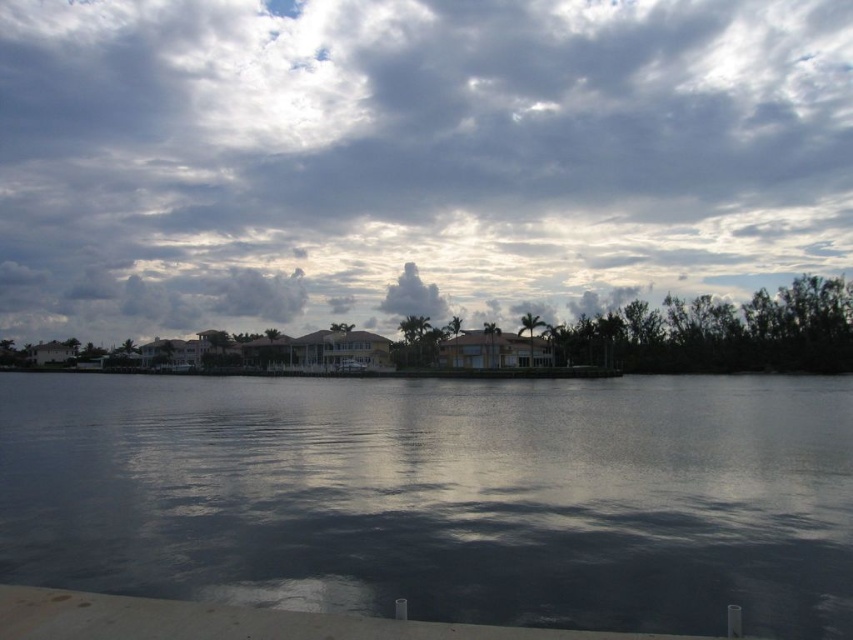
How much distance is there between dark reflective water at center and white fluffy cloud at upper center?

The distance of dark reflective water at center from white fluffy cloud at upper center is 409.20 feet.

Is dark reflective water at center taller than white fluffy cloud at upper center?

In fact, dark reflective water at center may be shorter than white fluffy cloud at upper center.

Which is in front, point (436, 483) or point (433, 304)?

Point (436, 483) is more forward.

Identify the location of dark reflective water at center. This screenshot has height=640, width=853. (442, 496).

Is cloudy sky at upper center further to camera compared to white fluffy cloud at upper center?

Yes, it is behind white fluffy cloud at upper center.

Consider the image. Can you confirm if cloudy sky at upper center is positioned below white fluffy cloud at upper center?

Actually, cloudy sky at upper center is above white fluffy cloud at upper center.

Between point (740, 230) and point (401, 301), which one is positioned in front?

Point (401, 301)

Locate an element on the screen. cloudy sky at upper center is located at coordinates (410, 156).

Which is below, cloudy sky at upper center or dark reflective water at center?

dark reflective water at center is below.

Does point (828, 45) lie in front of point (450, 504)?

No, it is behind (450, 504).

Who is more distant from viewer, (683, 147) or (585, 593)?

Point (683, 147)

This screenshot has height=640, width=853. I want to click on cloudy sky at upper center, so click(x=410, y=156).